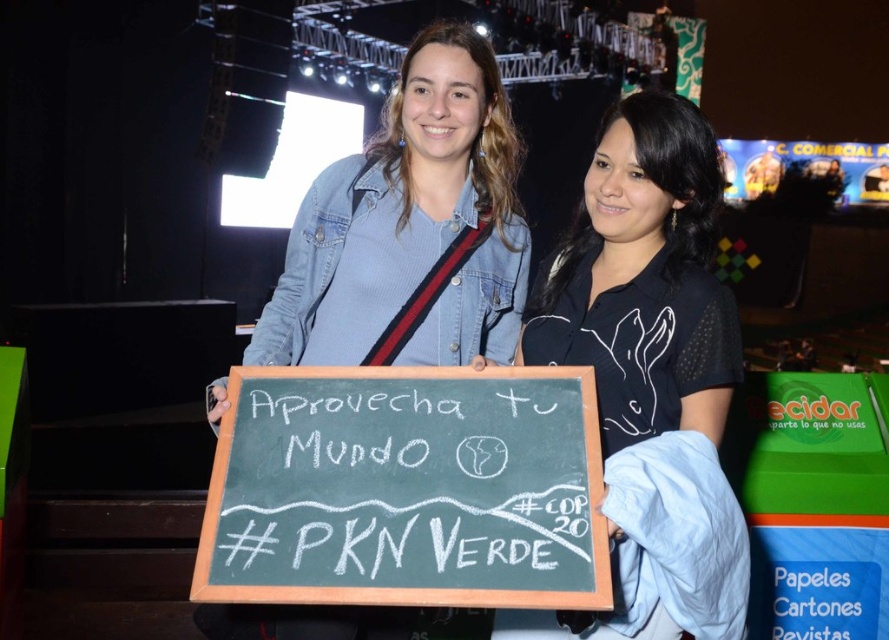
Question: Does black matte shirt at center have a smaller size compared to denim jacket at center?

Choices:
 (A) yes
 (B) no

Answer: (A)

Question: Which point is farther to the camera?

Choices:
 (A) (209, 492)
 (B) (265, 632)

Answer: (B)

Question: Can you confirm if black matte shirt at center is thinner than denim jacket at center?

Choices:
 (A) no
 (B) yes

Answer: (B)

Question: Which point is farther to the camera?

Choices:
 (A) denim jacket at center
 (B) black matte shirt at center

Answer: (A)

Question: Estimate the real-world distances between objects in this image. Which object is farther from the black chalkboard at center?

Choices:
 (A) denim jacket at center
 (B) black matte shirt at center

Answer: (B)

Question: Is black matte shirt at center below denim jacket at center?

Choices:
 (A) yes
 (B) no

Answer: (A)